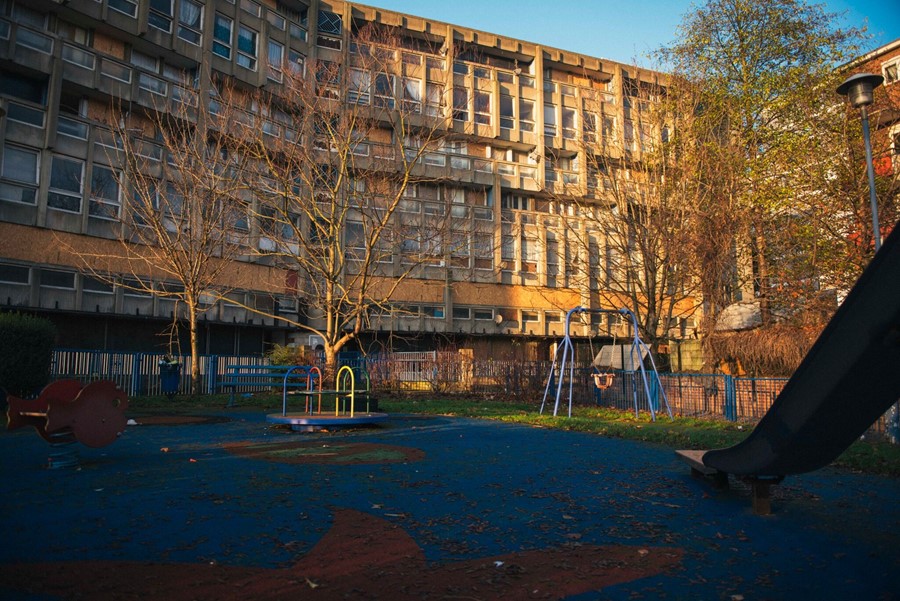
Locate an element on the screen. bench is located at coordinates (69, 406).